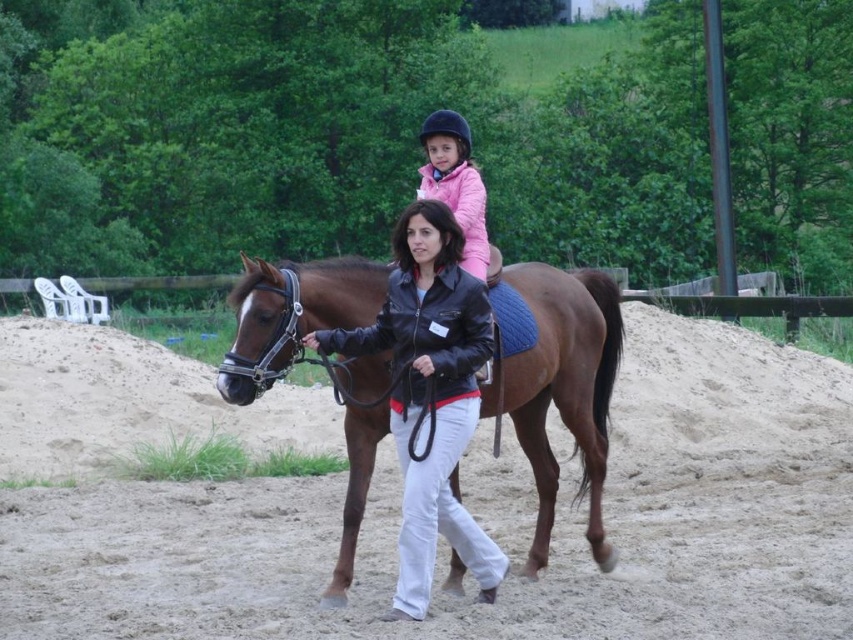
You are a photographer standing in the arena and want to capture the woman and the horse in a photo. To ensure both the sandy brown at lower center and the black leather jacket at center are visible, which object should be positioned to the right in the frame?

The sandy brown at lower center should be positioned to the right of the black leather jacket at center in the frame, as the sandy brown at lower center is located to the right of the black leather jacket at center in the scene.

You are a photographer standing at the edge of the arena. You want to take a photo of the brown glossy horse at center and the black leather jacket at center. Which object is closer to the left side of the photo frame?

The black leather jacket at center is closer to the left side of the photo frame because the brown glossy horse at center is positioned on the right side of it.

You are a photographer standing at the edge of the sandy arena. You want to take a photo of the sandy brown at lower center and the black leather jacket at center. Which object should you focus on first if you want to capture both in the same frame without moving your camera?

The sandy brown at lower center is not as tall as the black leather jacket at center, so you should focus on the black leather jacket at center first to ensure both are in the frame.